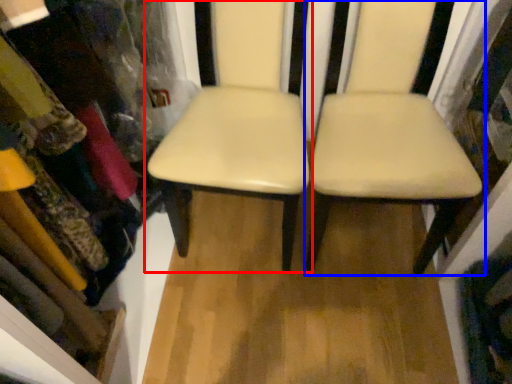
Question: Which object is further to the camera taking this photo, chair (highlighted by a red box) or chair (highlighted by a blue box)?

Choices:
 (A) chair
 (B) chair

Answer: (A)